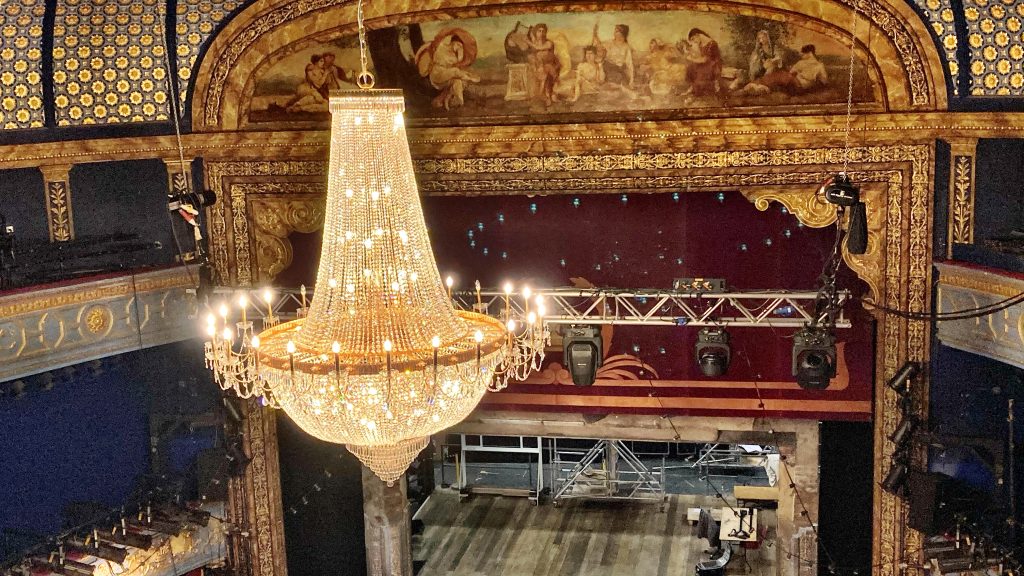
What are the coordinates of `sky in painting` in the screenshot? It's located at (635, 25).